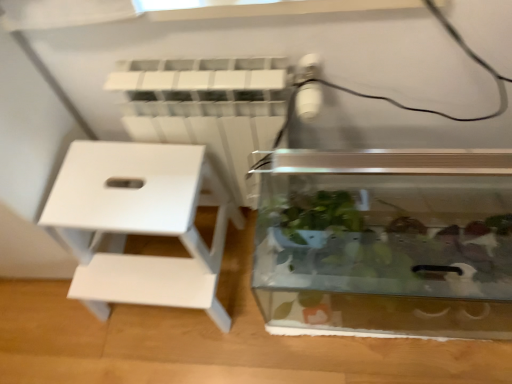
Question: Should I look upward or downward to see white plastic radiator at upper center?

Choices:
 (A) down
 (B) up

Answer: (B)

Question: Is transparent glass tank at center with white matte stool at left?

Choices:
 (A) no
 (B) yes

Answer: (A)

Question: Does transparent glass tank at center come behind white matte stool at left?

Choices:
 (A) no
 (B) yes

Answer: (A)

Question: Is transparent glass tank at center aimed at white matte stool at left?

Choices:
 (A) yes
 (B) no

Answer: (B)

Question: Does transparent glass tank at center contain white matte stool at left?

Choices:
 (A) yes
 (B) no

Answer: (B)

Question: Considering the relative sizes of transparent glass tank at center and white matte stool at left in the image provided, is transparent glass tank at center shorter than white matte stool at left?

Choices:
 (A) no
 (B) yes

Answer: (B)

Question: Is transparent glass tank at center bigger than white matte stool at left?

Choices:
 (A) no
 (B) yes

Answer: (B)

Question: From a real-world perspective, does white matte stool at left sit lower than white plastic radiator at upper center?

Choices:
 (A) no
 (B) yes

Answer: (B)

Question: From a real-world perspective, is white matte stool at left over white plastic radiator at upper center?

Choices:
 (A) no
 (B) yes

Answer: (A)

Question: Can you confirm if white matte stool at left is taller than white plastic radiator at upper center?

Choices:
 (A) no
 (B) yes

Answer: (A)

Question: Considering the relative sizes of white matte stool at left and white plastic radiator at upper center in the image provided, is white matte stool at left thinner than white plastic radiator at upper center?

Choices:
 (A) no
 (B) yes

Answer: (A)

Question: Is white matte stool at left looking in the opposite direction of white plastic radiator at upper center?

Choices:
 (A) no
 (B) yes

Answer: (B)

Question: Is white matte stool at left facing towards white plastic radiator at upper center?

Choices:
 (A) yes
 (B) no

Answer: (B)

Question: From a real-world perspective, is white plastic radiator at upper center below white matte stool at left?

Choices:
 (A) yes
 (B) no

Answer: (B)